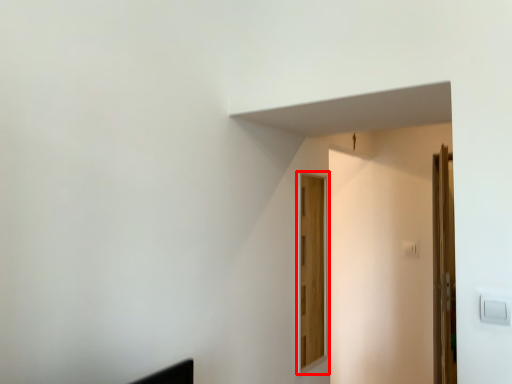
Question: From the image's perspective, what is the correct spatial positioning of door (annotated by the red box) in reference to door?

Choices:
 (A) below
 (B) above

Answer: (B)